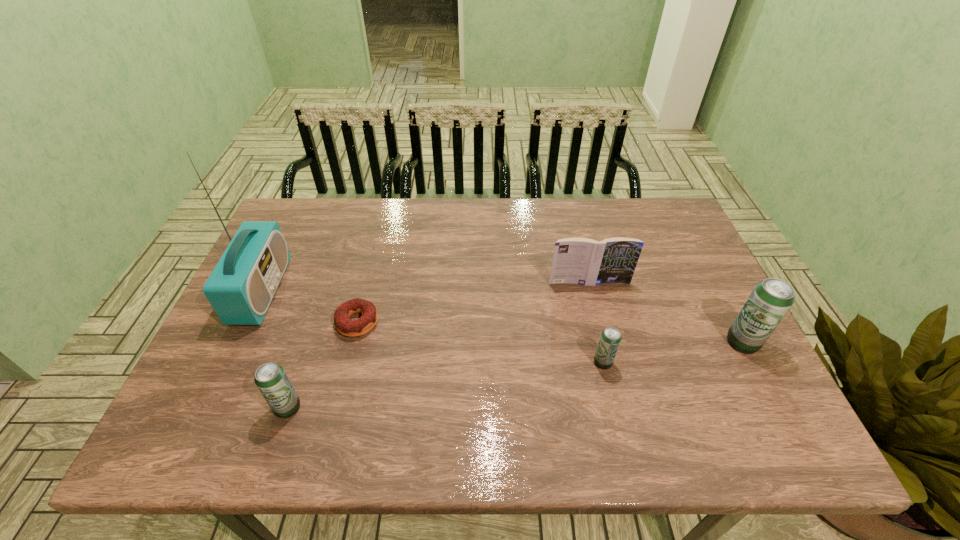
Where is `vacant space that satisfies the following two spatial constraints: 1. on the front panel of the nearest object; 2. on the left side of the leftmost object`? vacant space that satisfies the following two spatial constraints: 1. on the front panel of the nearest object; 2. on the left side of the leftmost object is located at coordinates (205, 408).

You are a GUI agent. You are given a task and a screenshot of the screen. Output one action in this format:
    pyautogui.click(x=<x>, y=<y>)
    Task: Click on the free spot that satisfies the following two spatial constraints: 1. on the front panel of the leftmost object; 2. on the left side of the leftmost beer can
    The image size is (960, 540).
    Given the screenshot: What is the action you would take?
    pyautogui.click(x=205, y=408)

The height and width of the screenshot is (540, 960). Identify the location of vacant space that satisfies the following two spatial constraints: 1. on the front panel of the leftmost object; 2. on the back side of the tallest beer can. (237, 342).

This screenshot has width=960, height=540. Find the location of `vacant region that satisfies the following two spatial constraints: 1. on the front cover of the book; 2. on the front panel of the tallest object`. vacant region that satisfies the following two spatial constraints: 1. on the front cover of the book; 2. on the front panel of the tallest object is located at coordinates (591, 291).

What are the coordinates of `free point that satisfies the following two spatial constraints: 1. on the front cover of the book; 2. on the front panel of the tallest object` in the screenshot? It's located at (591, 291).

Locate an element on the screen. The width and height of the screenshot is (960, 540). vacant space that satisfies the following two spatial constraints: 1. on the front panel of the shortest beer can; 2. on the left side of the tallest object is located at coordinates (228, 362).

Locate an element on the screen. Image resolution: width=960 pixels, height=540 pixels. free space that satisfies the following two spatial constraints: 1. on the front panel of the leftmost object; 2. on the right side of the rightmost object is located at coordinates (237, 342).

Where is `free point that satisfies the following two spatial constraints: 1. on the front panel of the tallest object; 2. on the back side of the rightmost object`? This screenshot has height=540, width=960. free point that satisfies the following two spatial constraints: 1. on the front panel of the tallest object; 2. on the back side of the rightmost object is located at coordinates (237, 342).

Identify the location of vacant space that satisfies the following two spatial constraints: 1. on the front panel of the shortest beer can; 2. on the left side of the leftmost object. (228, 362).

The width and height of the screenshot is (960, 540). I want to click on free location that satisfies the following two spatial constraints: 1. on the front panel of the radio receiver; 2. on the right side of the second tallest beer can, so click(205, 408).